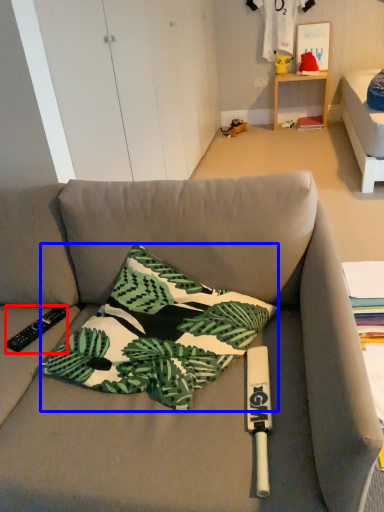
Question: Which object is closer to the camera taking this photo, remote control (highlighted by a red box) or pillow (highlighted by a blue box)?

Choices:
 (A) remote control
 (B) pillow

Answer: (B)